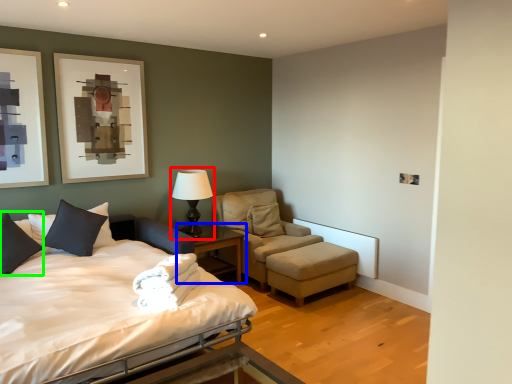
Question: Which object is the farthest from table lamp (highlighted by a red box)? Choose among these: nightstand (highlighted by a blue box) or pillow (highlighted by a green box).

Choices:
 (A) nightstand
 (B) pillow

Answer: (B)